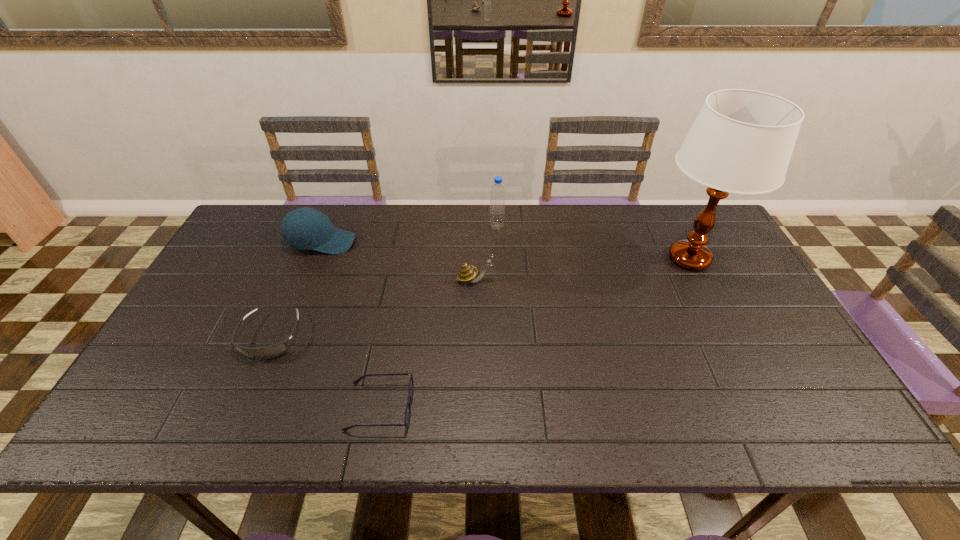
Where is `vacant space at the far edge`? This screenshot has width=960, height=540. vacant space at the far edge is located at coordinates (333, 208).

This screenshot has width=960, height=540. I want to click on vacant space at the left edge of the desktop, so click(x=219, y=265).

I want to click on vacant space at the right edge of the desktop, so click(x=762, y=333).

Locate an element on the screen. The image size is (960, 540). free spot at the far left corner of the desktop is located at coordinates (280, 236).

In order to click on free point between the baseball cap and the fifth shortest object in this screenshot , I will do `click(409, 234)`.

Where is `empty space between the second tallest object and the goggles`? Image resolution: width=960 pixels, height=540 pixels. empty space between the second tallest object and the goggles is located at coordinates (383, 282).

Identify the location of vacant region between the goggles and the rightmost object. (480, 298).

The height and width of the screenshot is (540, 960). Find the location of `vacant area between the fifth farthest object and the tallest object`. vacant area between the fifth farthest object and the tallest object is located at coordinates (480, 298).

Where is `free space between the second tallest object and the rightmost object`? free space between the second tallest object and the rightmost object is located at coordinates click(x=593, y=242).

Find the location of a particular element. This screenshot has height=540, width=960. vacant point located between the second tallest object and the rightmost object is located at coordinates (593, 242).